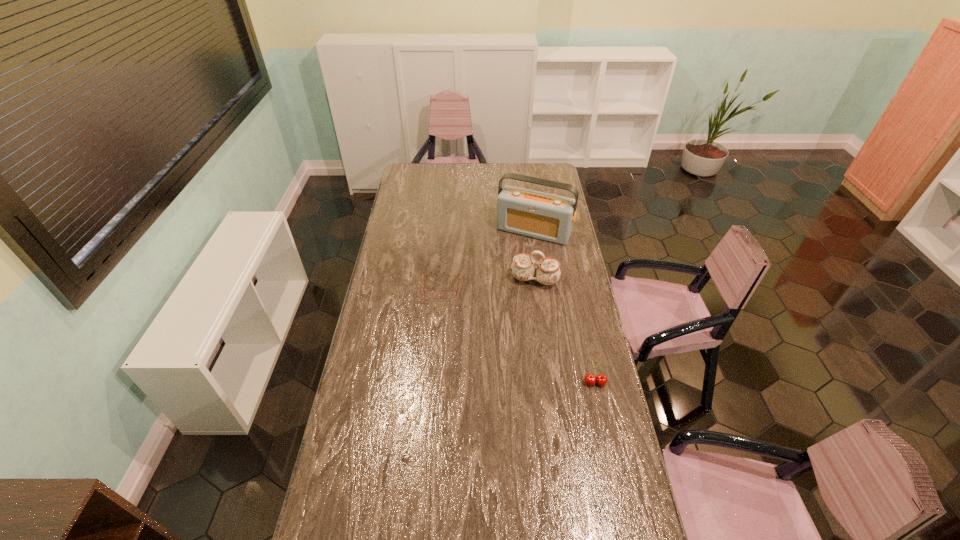
Locate an element on the screen. The width and height of the screenshot is (960, 540). free space at the right edge of the desktop is located at coordinates (542, 187).

In the image, there is a desktop. At what (x,y) coordinates should I click in order to perform the action: click on blank space at the near left corner. Please return your answer as a coordinate pair (x, y). The image size is (960, 540). Looking at the image, I should click on (349, 516).

Identify the location of vacant space in between the tallest object and the nearest object. The width and height of the screenshot is (960, 540). (564, 307).

I want to click on free spot between the farthest object and the chinaware, so click(x=534, y=255).

Where is `empty location between the tallest object and the shortest object`? This screenshot has height=540, width=960. empty location between the tallest object and the shortest object is located at coordinates (488, 259).

Find the location of a particular element. vacant area between the nearest object and the shortest object is located at coordinates (518, 335).

Image resolution: width=960 pixels, height=540 pixels. Find the location of `free space between the third shortest object and the shortest object`. free space between the third shortest object and the shortest object is located at coordinates (488, 284).

Where is `unoccupied area between the farthest object and the third tallest object`? The width and height of the screenshot is (960, 540). unoccupied area between the farthest object and the third tallest object is located at coordinates (564, 307).

Find the location of a particular element. The width and height of the screenshot is (960, 540). vacant space in between the tallest object and the nearest object is located at coordinates (564, 307).

Identify the location of vacant point located between the spectacles and the third shortest object. pos(488,284).